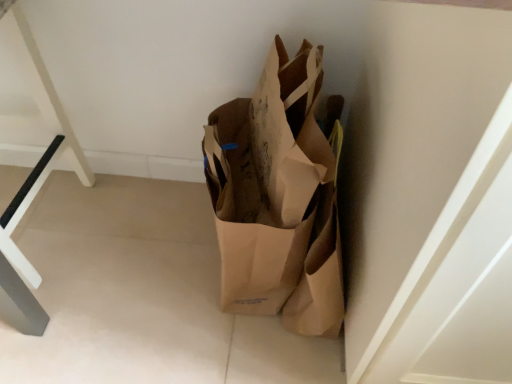
Where is `vacant space that's between white plastic table at left and brown paper bag at center`? This screenshot has width=512, height=384. vacant space that's between white plastic table at left and brown paper bag at center is located at coordinates (143, 249).